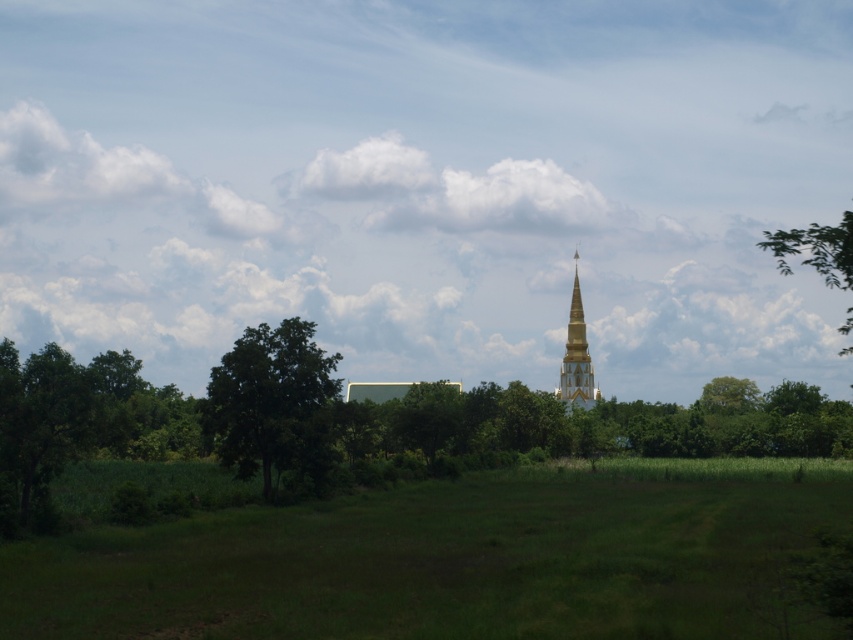
You are standing at the center of the field in the image. Which direction should you walk to reach the green leafy tree at left?

Since the green leafy tree at left is located at coordinates 0.631 on the x axis and 0.321 on the y axis, you should walk towards the left side of the image to reach it.

You are a tourist standing at the base of the gold metallic stupa at center and want to take a photo of the green leafy tree at upper right. If your camera has a maximum zoom range of 50 meters, can you capture the tree in the photo without moving?

The green leafy tree at upper right and gold metallic stupa at center are 67.80 meters apart. Since the camera can only zoom up to 50 meters, you cannot capture the tree in the photo without moving closer.